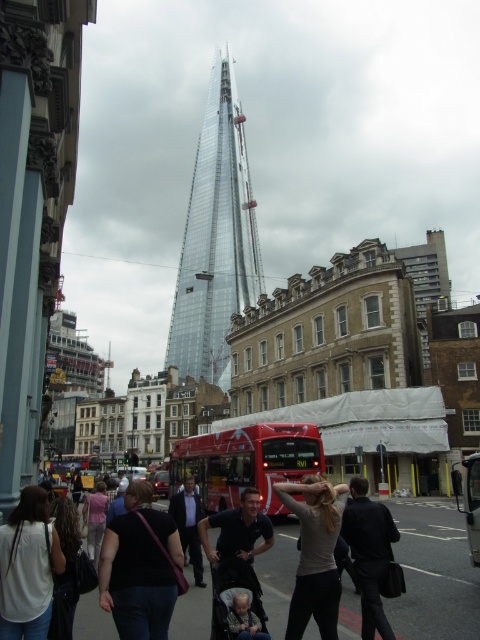
Question: Can you confirm if transparent glass tower at center is positioned to the left of dark gray suit at center?

Choices:
 (A) yes
 (B) no

Answer: (A)

Question: Considering the relative positions of black leather jacket at lower right and pink fabric at center in the image provided, where is black leather jacket at lower right located with respect to pink fabric at center?

Choices:
 (A) right
 (B) left

Answer: (A)

Question: Which point appears farthest from the camera in this image?

Choices:
 (A) coord(231,476)
 (B) coord(37,540)

Answer: (A)

Question: Which point appears farthest from the camera in this image?

Choices:
 (A) (300, 506)
 (B) (215, 108)
 (C) (70, 570)

Answer: (B)

Question: Can you confirm if black fabric purse at lower left is smaller than light gray fabric at center?

Choices:
 (A) yes
 (B) no

Answer: (A)

Question: Which of the following is the farthest from the observer?

Choices:
 (A) (29, 628)
 (B) (355, 561)

Answer: (B)